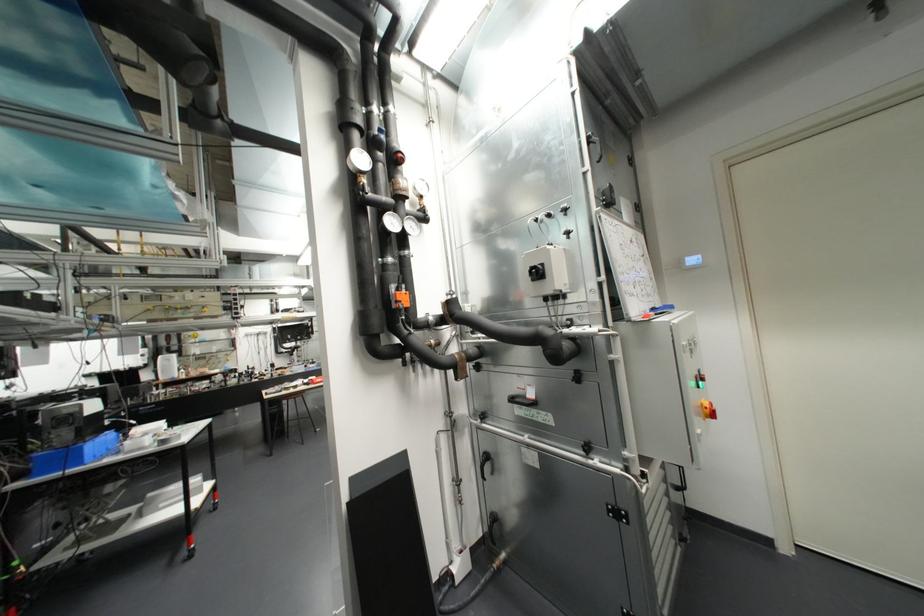
Locate an element on the screen. The height and width of the screenshot is (616, 924). green push button is located at coordinates (698, 384).